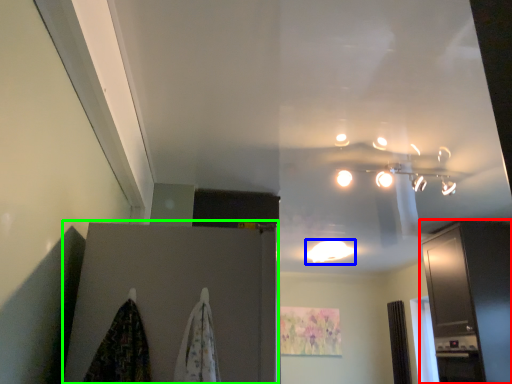
Question: Based on their relative distances, which object is farther from cabinetry (highlighted by a red box)? Choose from lighting (highlighted by a blue box) and door (highlighted by a green box).

Choices:
 (A) lighting
 (B) door

Answer: (B)